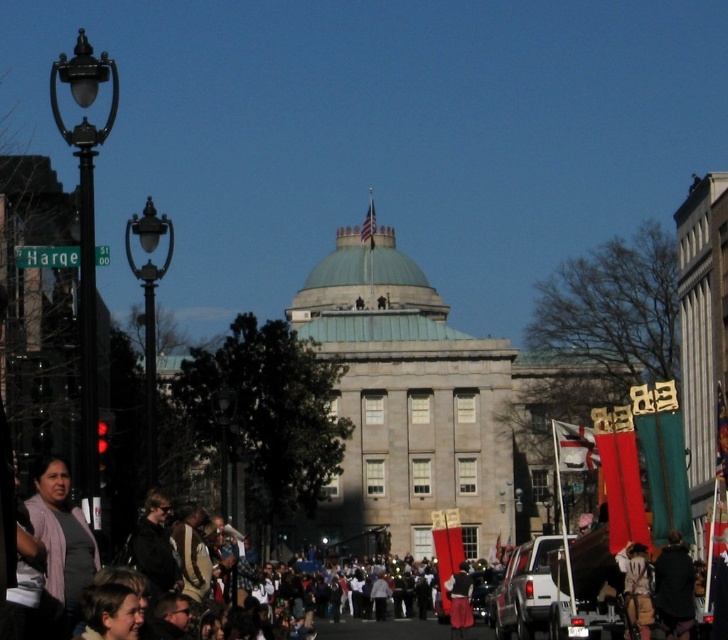
Consider the image. Between white matte truck at lower center and camouflage fabric jacket at lower right, which one appears on the left side from the viewer's perspective?

white matte truck at lower center is more to the left.

Who is positioned more to the right, white matte truck at lower center or camouflage fabric jacket at lower right?

From the viewer's perspective, camouflage fabric jacket at lower right appears more on the right side.

Which is in front, point (510, 618) or point (638, 568)?

Positioned in front is point (638, 568).

Identify the location of white matte truck at lower center. (542, 592).

Can you confirm if white matte truck at lower center is positioned below american flag at center?

Indeed, white matte truck at lower center is positioned under american flag at center.

Which is in front, point (502, 595) or point (367, 230)?

Point (502, 595)

Does point (549, 605) come in front of point (365, 220)?

Yes, it is in front of point (365, 220).

Where is `white matte truck at lower center`? white matte truck at lower center is located at coordinates (542, 592).

Is dark brown leather jacket at lower right in front of american flag at center?

Yes, it is in front of american flag at center.

Who is more distant from viewer, (673, 632) or (368, 243)?

Point (368, 243)

This screenshot has width=728, height=640. Find the location of `dark brown leather jacket at lower right`. dark brown leather jacket at lower right is located at coordinates (673, 588).